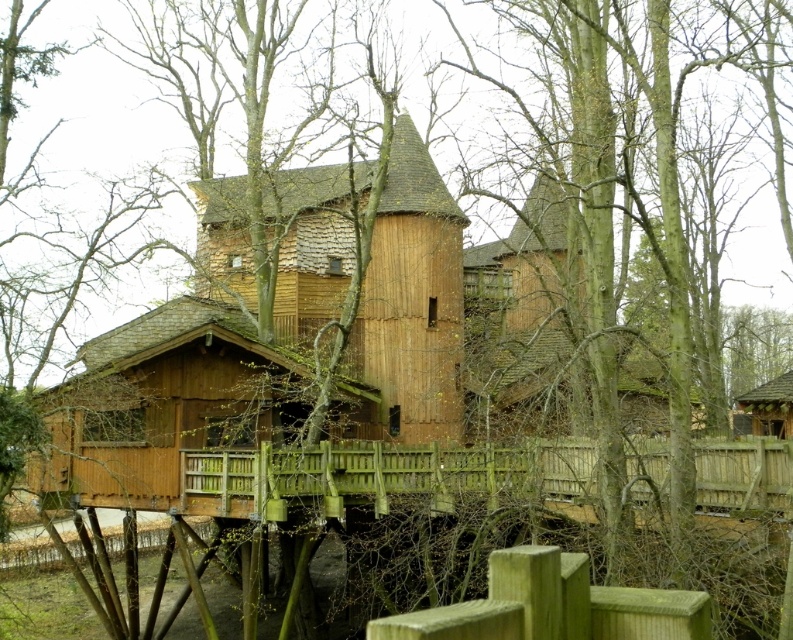
Question: Which point is farther to the camera?

Choices:
 (A) wooden cabin at center
 (B) green rough wooden post at lower center
 (C) wooden hut at right

Answer: (C)

Question: Which point is farther from the camera taking this photo?

Choices:
 (A) (780, 384)
 (B) (454, 412)
 (C) (663, 636)
 (D) (301, 368)

Answer: (A)

Question: Does green rough wooden post at lower center have a greater width compared to wooden hut at right?

Choices:
 (A) yes
 (B) no

Answer: (B)

Question: In this image, where is wooden hut at center located relative to wooden hut at right?

Choices:
 (A) above
 (B) below

Answer: (A)

Question: Which object is farther from the camera taking this photo?

Choices:
 (A) wooden cabin at center
 (B) wooden hut at right
 (C) green rough wooden post at lower center
 (D) wooden hut at center

Answer: (B)

Question: Does wooden hut at center have a larger size compared to green rough wooden post at lower center?

Choices:
 (A) yes
 (B) no

Answer: (A)